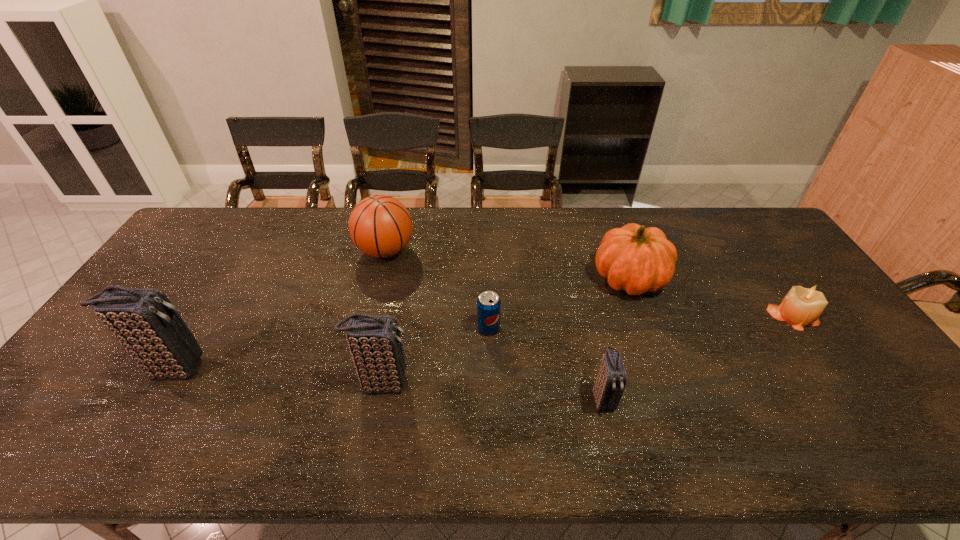
In the current image, all clutch bags are evenly spaced. To maintain this equal spacing, where should an additional clutch bag be placed on the right? Please point out a free spot. Please provide its 2D coordinates. Your answer should be formatted as a tuple, i.e. [(x, y)], where the tuple contains the x and y coordinates of a point satisfying the conditions above.

[(837, 415)]